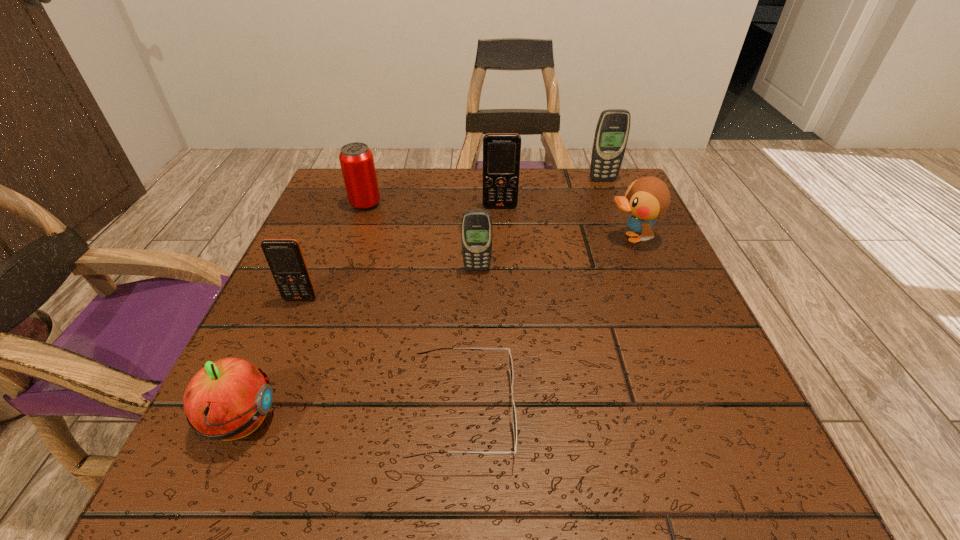
The width and height of the screenshot is (960, 540). I want to click on duck positioned at the right edge, so click(647, 198).

The image size is (960, 540). Find the location of `object that is at the far left corner`. object that is at the far left corner is located at coordinates (356, 159).

The image size is (960, 540). I want to click on object present at the near left corner, so click(228, 399).

You are a GUI agent. You are given a task and a screenshot of the screen. Output one action in this format:
    pyautogui.click(x=<x>, y=<y>)
    Task: Click on the object present at the far right corner
    The height and width of the screenshot is (540, 960).
    Given the screenshot: What is the action you would take?
    pyautogui.click(x=612, y=131)

Locate an element on the screen. This screenshot has height=540, width=960. vacant region at the far edge of the desktop is located at coordinates (465, 185).

In the image, there is a desktop. Where is `blank space at the near edge`? The height and width of the screenshot is (540, 960). blank space at the near edge is located at coordinates (622, 483).

This screenshot has height=540, width=960. I want to click on free location at the left edge of the desktop, so click(x=336, y=248).

In the image, there is a desktop. Identify the location of vacant space at the right edge. (690, 361).

Find the location of a particular element. The height and width of the screenshot is (540, 960). free spot at the near left corner of the desktop is located at coordinates (283, 435).

The width and height of the screenshot is (960, 540). In order to click on free spot at the far right corner of the desktop in this screenshot , I will do `click(570, 171)`.